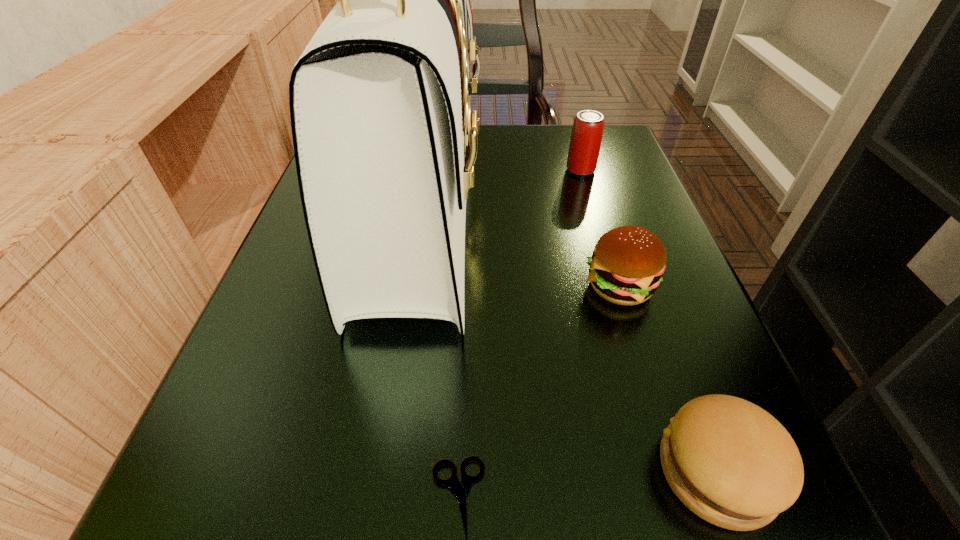
Find the location of `the tallest object`. the tallest object is located at coordinates [x=385, y=142].

What are the coordinates of `beer can` in the screenshot? It's located at (586, 137).

Image resolution: width=960 pixels, height=540 pixels. Identify the location of the farther hamburger. (627, 264).

In order to click on the taller hamburger in this screenshot , I will do `click(627, 264)`.

What are the coordinates of `the shorter hamburger` in the screenshot? It's located at (729, 461).

Locate an element on the screen. Image resolution: width=960 pixels, height=540 pixels. the second shortest object is located at coordinates (729, 461).

Find the location of a particular element. The width and height of the screenshot is (960, 540). free space located 0.220m on the front-facing side of the satchel is located at coordinates (605, 211).

Where is `vacant region located on the left of the second tallest object`? The height and width of the screenshot is (540, 960). vacant region located on the left of the second tallest object is located at coordinates (440, 171).

Image resolution: width=960 pixels, height=540 pixels. I want to click on vacant space located on the left of the third tallest object, so click(446, 286).

Where is `free spot located on the back of the nearer hamburger`? This screenshot has width=960, height=540. free spot located on the back of the nearer hamburger is located at coordinates (660, 322).